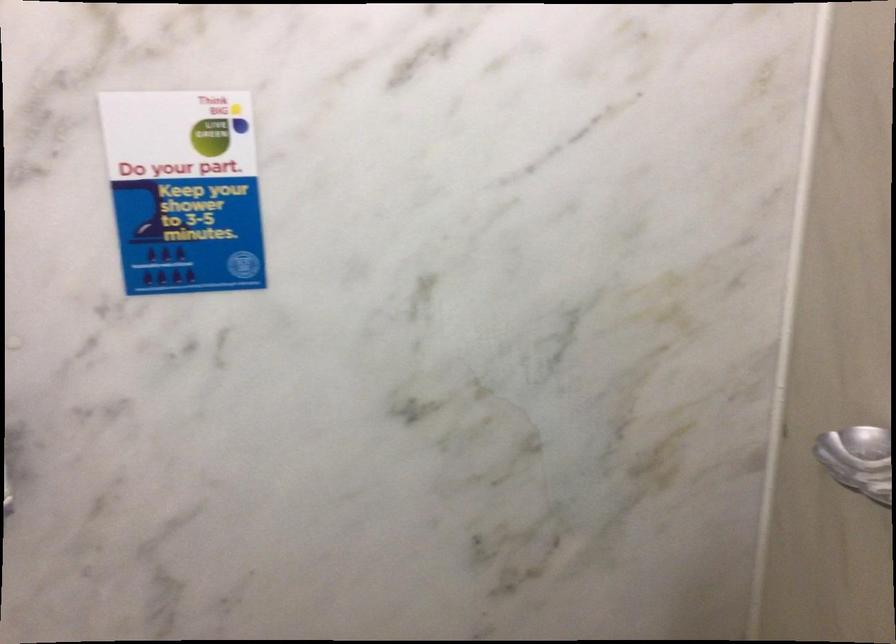
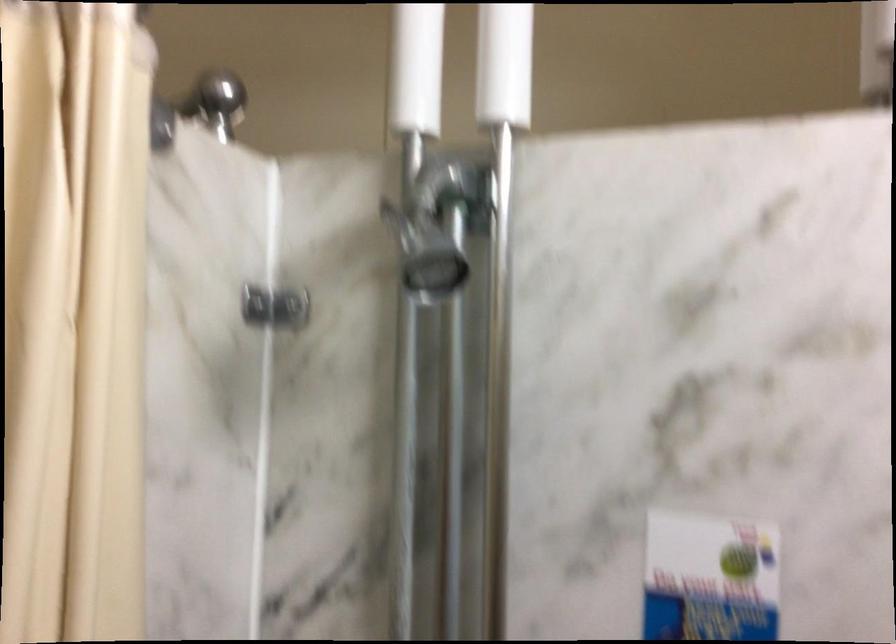
Looking at this image, the first image is from the beginning of the video and the second image is from the end. How did the camera likely rotate when shooting the video?

The camera rotated toward right-down.